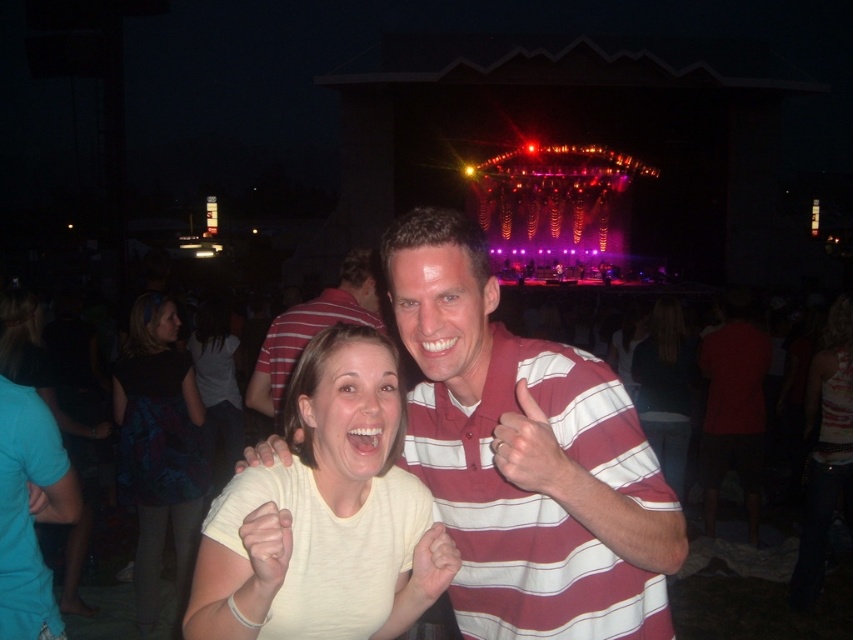
Question: Does white striped polo shirt at center have a smaller size compared to dark red shirt at right?

Choices:
 (A) yes
 (B) no

Answer: (B)

Question: Among these objects, which one is farthest from the camera?

Choices:
 (A) white matte t-shirt at center
 (B) light yellow shirt at center

Answer: (B)

Question: Does dark red shirt at right have a larger size compared to light yellow shirt at center?

Choices:
 (A) no
 (B) yes

Answer: (A)

Question: Is light yellow shirt at center in front of smooth red shirt at center?

Choices:
 (A) no
 (B) yes

Answer: (A)

Question: Which point appears closest to the camera in this image?

Choices:
 (A) (758, 346)
 (B) (222, 416)

Answer: (A)

Question: Which point is closer to the camera?

Choices:
 (A) (306, 376)
 (B) (425, 257)
 (C) (685, 417)
 (D) (457, 614)

Answer: (A)